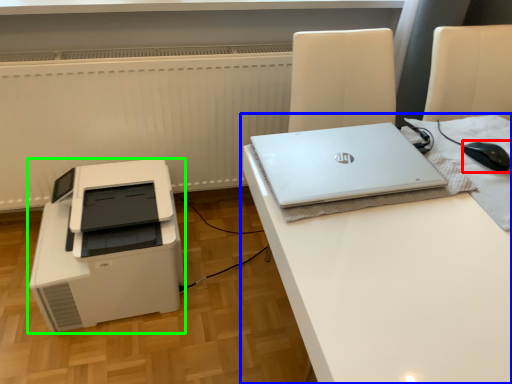
Question: Which is nearer to the mouse (highlighted by a red box)? desk (highlighted by a blue box) or printer (highlighted by a green box).

Choices:
 (A) desk
 (B) printer

Answer: (A)